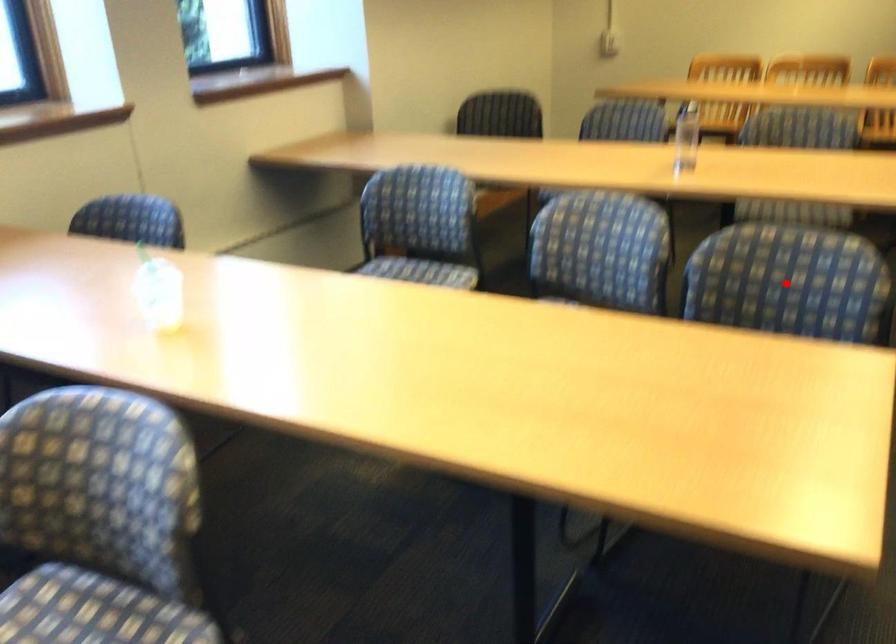
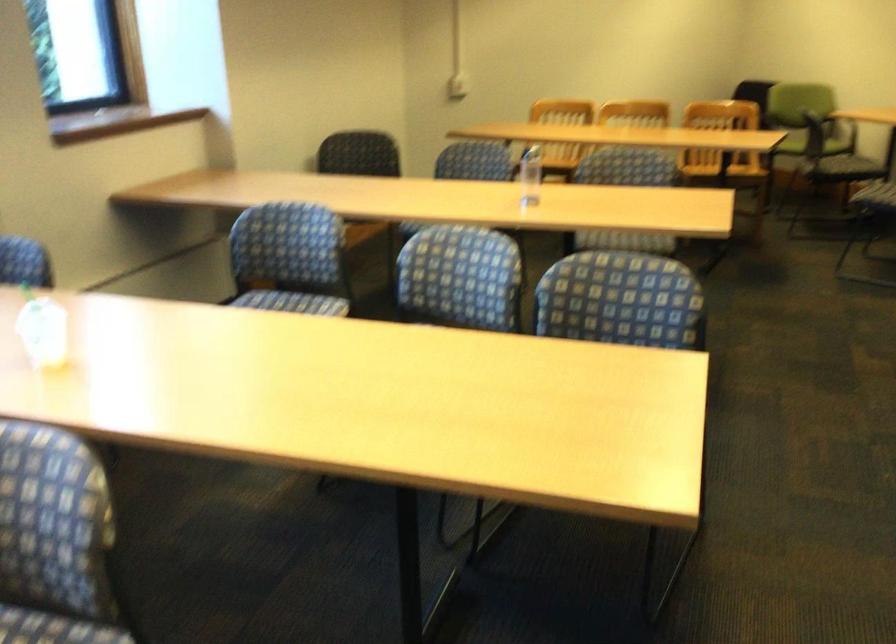
The point at the highlighted location is marked in the first image. Where is the corresponding point in the second image?

(622, 301)